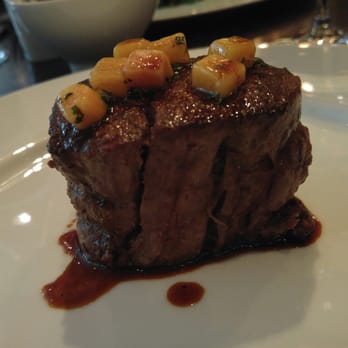
Find the location of a particular element. place to put silverware is located at coordinates (6, 40).